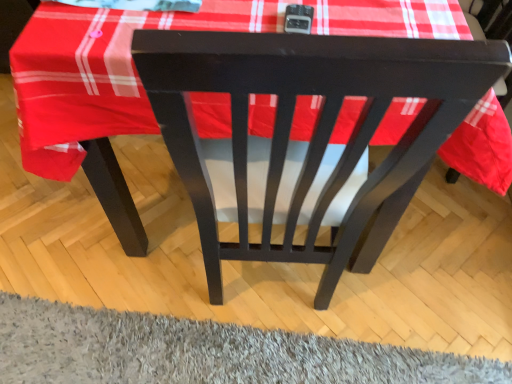
At what (x,y) coordinates should I click in order to perform the action: click on vacant area on top of gray shaggy rug at lower center (from a real-world perspective). Please return your answer as a coordinate pair (x, y). Image resolution: width=512 pixels, height=384 pixels. Looking at the image, I should click on (200, 354).